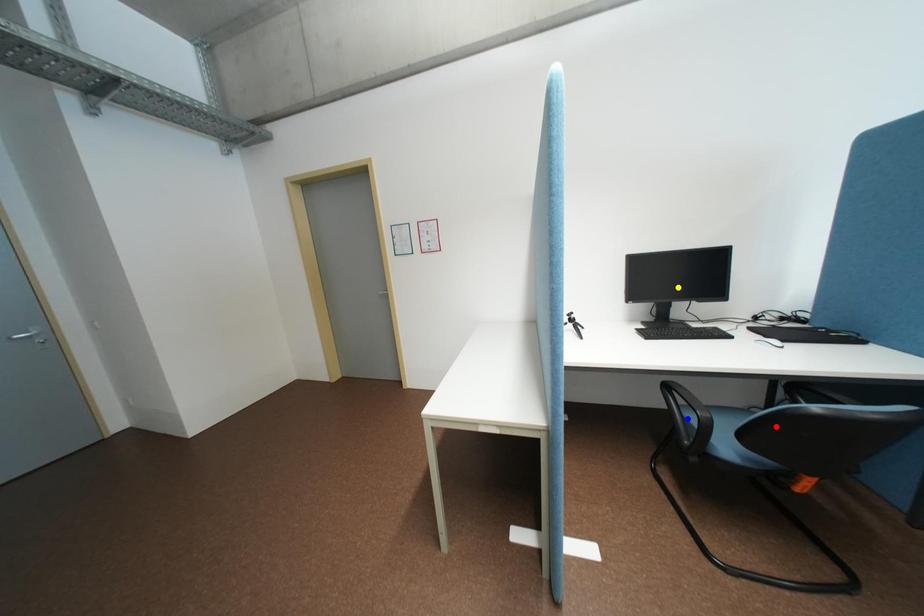
Order these from nearest to farthest:
yellow point, red point, blue point

red point → blue point → yellow point